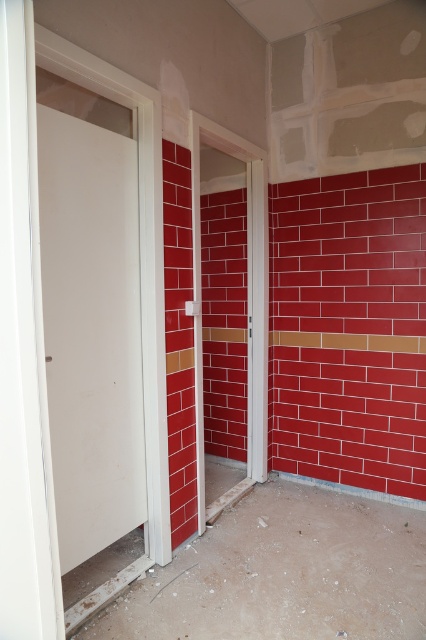
Question: Considering the relative positions of white matte door at left and white glossy door at center in the image provided, where is white matte door at left located with respect to white glossy door at center?

Choices:
 (A) left
 (B) right

Answer: (A)

Question: Is white matte door at left positioned in front of white glossy door at center?

Choices:
 (A) no
 (B) yes

Answer: (B)

Question: Where is white matte door at left located in relation to white glossy door at center in the image?

Choices:
 (A) below
 (B) above

Answer: (A)

Question: Which object appears farthest from the camera in this image?

Choices:
 (A) white matte door at left
 (B) white glossy door at center

Answer: (B)